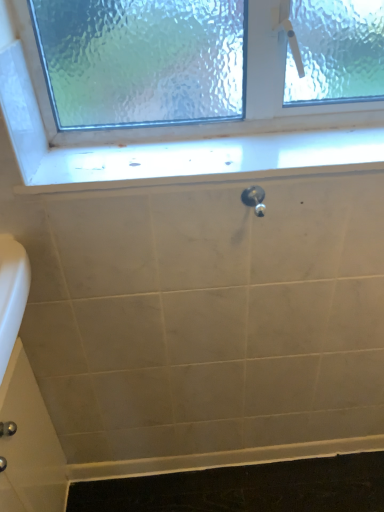
Question: Should I look upward or downward to see satin nickel faucet at center?

Choices:
 (A) up
 (B) down

Answer: (A)

Question: From the image's perspective, is white glossy window sill at upper center located beneath satin nickel faucet at center?

Choices:
 (A) yes
 (B) no

Answer: (B)

Question: Would you say white glossy window sill at upper center is a long distance from satin nickel faucet at center?

Choices:
 (A) no
 (B) yes

Answer: (A)

Question: Is white glossy window sill at upper center taller than satin nickel faucet at center?

Choices:
 (A) no
 (B) yes

Answer: (A)

Question: Can you confirm if white glossy window sill at upper center is smaller than satin nickel faucet at center?

Choices:
 (A) yes
 (B) no

Answer: (B)

Question: Is white glossy window sill at upper center positioned in front of satin nickel faucet at center?

Choices:
 (A) yes
 (B) no

Answer: (B)

Question: Is satin nickel faucet at center surrounded by white glossy window sill at upper center?

Choices:
 (A) no
 (B) yes

Answer: (A)

Question: Is satin nickel faucet at center positioned with its back to white glossy window sill at upper center?

Choices:
 (A) yes
 (B) no

Answer: (A)

Question: Considering the relative sizes of satin nickel faucet at center and white glossy window sill at upper center in the image provided, is satin nickel faucet at center thinner than white glossy window sill at upper center?

Choices:
 (A) yes
 (B) no

Answer: (A)

Question: Is satin nickel faucet at center to the right of white glossy window sill at upper center from the viewer's perspective?

Choices:
 (A) yes
 (B) no

Answer: (A)

Question: Does satin nickel faucet at center have a lesser height compared to white glossy window sill at upper center?

Choices:
 (A) yes
 (B) no

Answer: (B)

Question: Does satin nickel faucet at center have a smaller size compared to white glossy window sill at upper center?

Choices:
 (A) no
 (B) yes

Answer: (B)

Question: From the image's perspective, is satin nickel faucet at center located above white glossy window sill at upper center?

Choices:
 (A) no
 (B) yes

Answer: (A)

Question: In terms of width, does satin nickel faucet at center look wider or thinner when compared to white glossy window sill at upper center?

Choices:
 (A) wide
 (B) thin

Answer: (B)